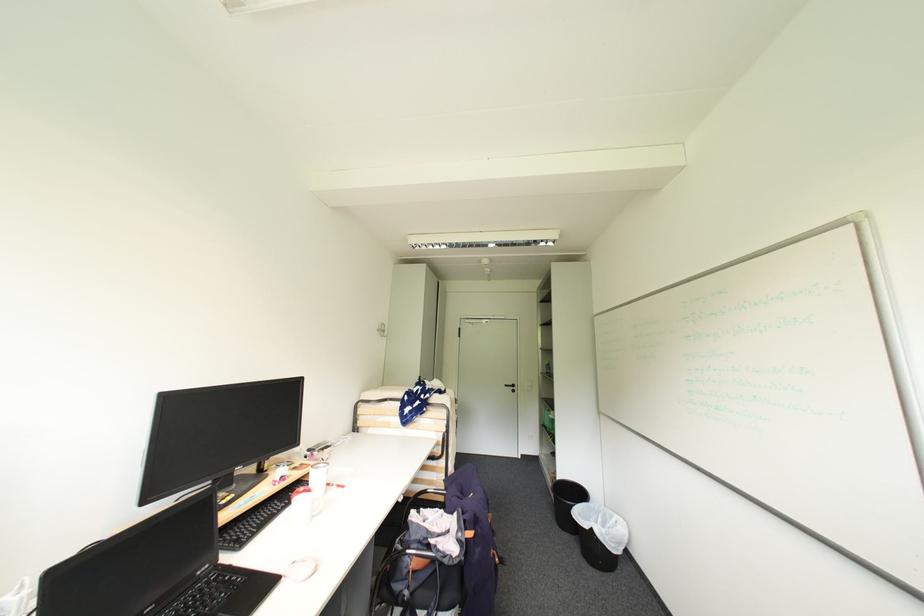
What do you see at coordinates (600, 535) in the screenshot? I see `the black trash can` at bounding box center [600, 535].